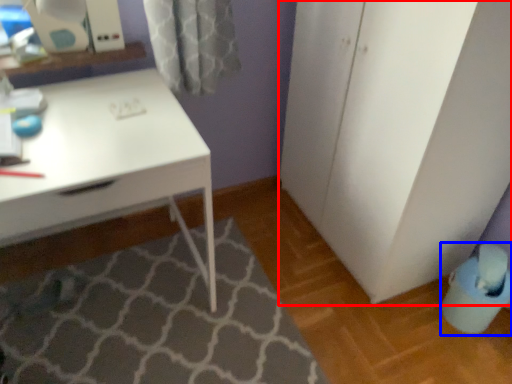
Question: Which object is further to the camera taking this photo, file cabinet (highlighted by a red box) or swivel chair (highlighted by a blue box)?

Choices:
 (A) file cabinet
 (B) swivel chair

Answer: (B)